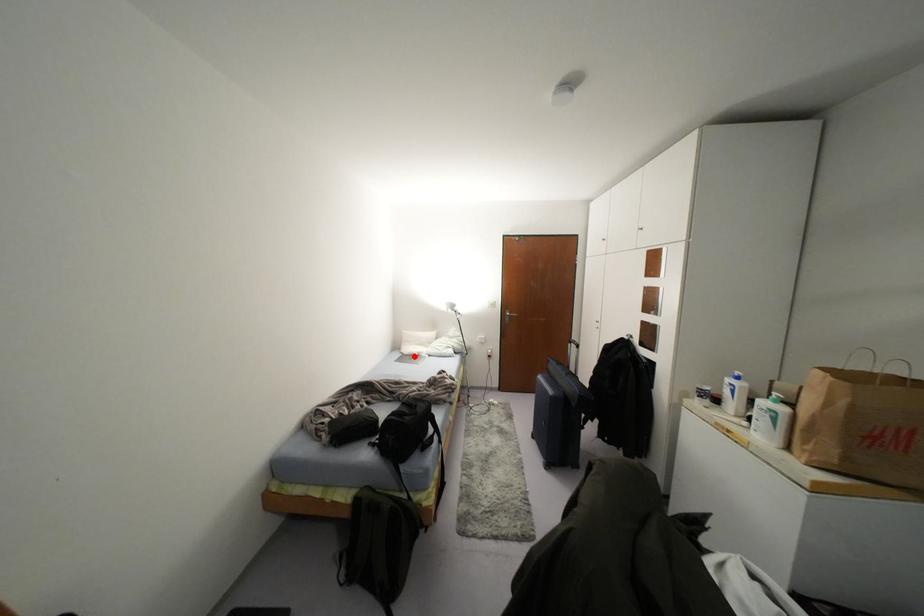
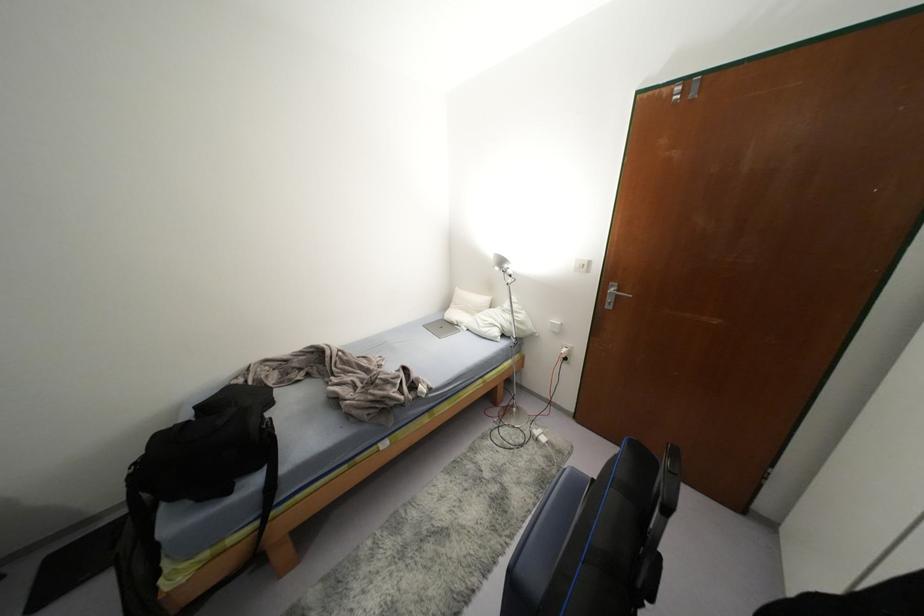
The point at the highlighted location is marked in the first image. Where is the corresponding point in the second image?

(452, 325)